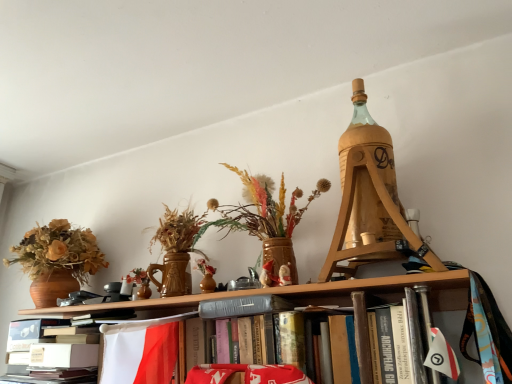
Question: Is wooden tripod at upper right not inside gray fabric bookshelf at center?

Choices:
 (A) yes
 (B) no

Answer: (A)

Question: Can you confirm if wooden tripod at upper right is taller than gray fabric bookshelf at center?

Choices:
 (A) yes
 (B) no

Answer: (A)

Question: Considering the relative sizes of wooden tripod at upper right and gray fabric bookshelf at center in the image provided, is wooden tripod at upper right wider than gray fabric bookshelf at center?

Choices:
 (A) no
 (B) yes

Answer: (B)

Question: Is wooden tripod at upper right not near gray fabric bookshelf at center?

Choices:
 (A) no
 (B) yes

Answer: (A)

Question: Is wooden tripod at upper right to the right of gray fabric bookshelf at center from the viewer's perspective?

Choices:
 (A) yes
 (B) no

Answer: (A)

Question: In terms of width, does white paper at lower left look wider or thinner when compared to gray fabric bookshelf at center?

Choices:
 (A) thin
 (B) wide

Answer: (B)

Question: Would you say white paper at lower left is to the left or to the right of gray fabric bookshelf at center in the picture?

Choices:
 (A) left
 (B) right

Answer: (A)

Question: From the image's perspective, relative to gray fabric bookshelf at center, is white paper at lower left above or below?

Choices:
 (A) above
 (B) below

Answer: (B)

Question: Is point (50, 362) closer or farther from the camera than point (415, 278)?

Choices:
 (A) farther
 (B) closer

Answer: (A)

Question: Considering the positions of point (454, 274) and point (30, 357), is point (454, 274) closer or farther from the camera than point (30, 357)?

Choices:
 (A) farther
 (B) closer

Answer: (B)

Question: From a real-world perspective, is gray fabric bookshelf at center positioned above or below white paper at lower left?

Choices:
 (A) above
 (B) below

Answer: (A)

Question: In the image, is gray fabric bookshelf at center positioned in front of or behind white paper at lower left?

Choices:
 (A) behind
 (B) front

Answer: (B)

Question: Considering the positions of gray fabric bookshelf at center and white paper at lower left in the image, is gray fabric bookshelf at center taller or shorter than white paper at lower left?

Choices:
 (A) short
 (B) tall

Answer: (B)

Question: Considering the positions of wooden tripod at upper right and gray fabric bookshelf at center in the image, is wooden tripod at upper right wider or thinner than gray fabric bookshelf at center?

Choices:
 (A) wide
 (B) thin

Answer: (A)

Question: Considering the positions of point (374, 142) and point (67, 309), is point (374, 142) closer or farther from the camera than point (67, 309)?

Choices:
 (A) farther
 (B) closer

Answer: (B)